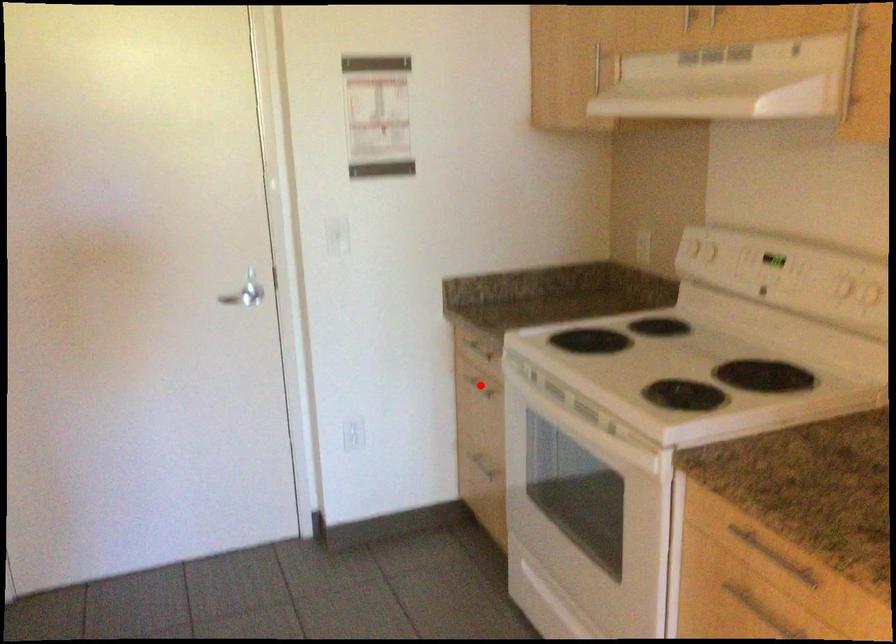
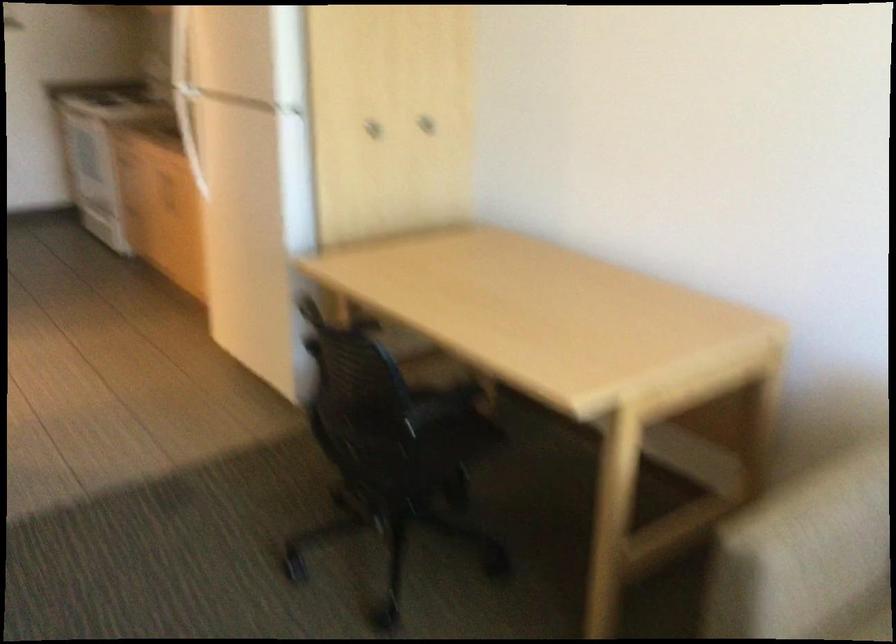
Question: I am providing you with two images of the same scene from different viewpoints. A red point is marked on the first image. At the location where the point appears in image 1, is it still visible in image 2?

Choices:
 (A) Yes
 (B) No

Answer: (B)